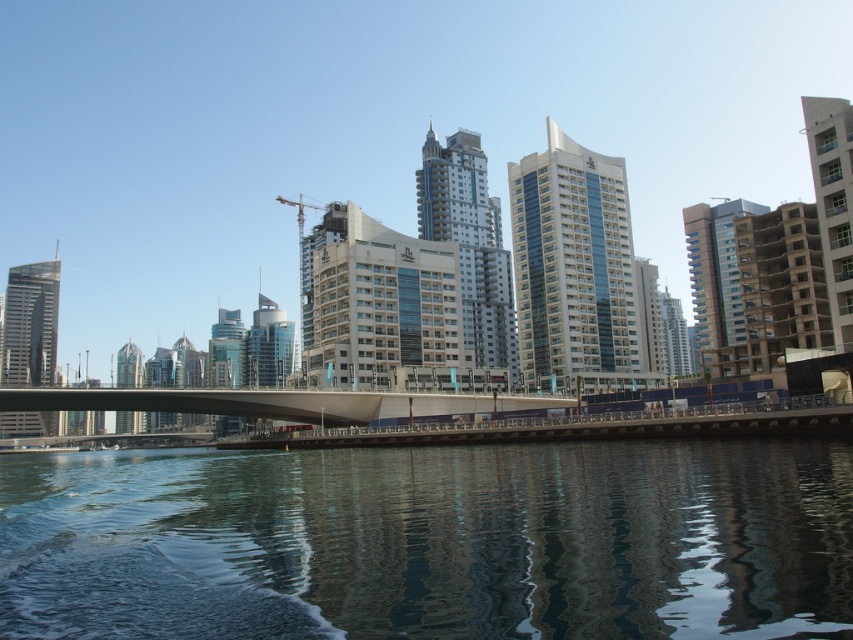
Looking at this image, you are standing at the center of the pedestrian bridge and want to determine which of the two points, point (721,228) or point (281,196), is closer to you. Based on the scene description, which point is nearer?

Point (721,228) is closer to the viewer than point (281,196).

You are a city planner assessing the urban skyline. You need to determine which building, the metallic glass building at center or the beige concrete building at right, would cast a longer shadow during midday. Based on their heights, which one would it be?

The metallic glass building at center is much taller than the beige concrete building at right, so it would cast a longer shadow during midday.

You are standing at the point marked by point (431, 541) in the image. What do you see directly below you?

Transparent water at lower center is directly below point (431, 541).